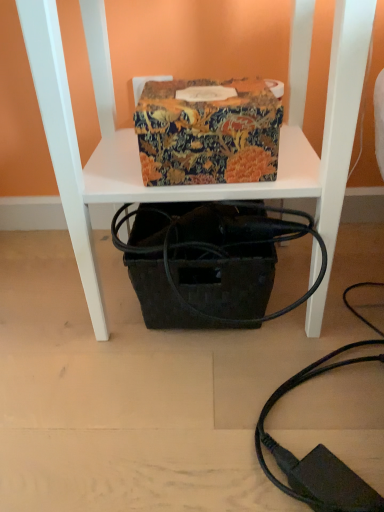
Question: Does patterned fabric box at center appear on the left side of black woven basket at center?

Choices:
 (A) no
 (B) yes

Answer: (B)

Question: Considering the relative sizes of patterned fabric box at center and black woven basket at center in the image provided, is patterned fabric box at center taller than black woven basket at center?

Choices:
 (A) no
 (B) yes

Answer: (A)

Question: Considering the relative sizes of patterned fabric box at center and black woven basket at center in the image provided, is patterned fabric box at center shorter than black woven basket at center?

Choices:
 (A) yes
 (B) no

Answer: (A)

Question: Is patterned fabric box at center further to the viewer compared to black woven basket at center?

Choices:
 (A) no
 (B) yes

Answer: (A)

Question: From the image's perspective, does patterned fabric box at center appear lower than black woven basket at center?

Choices:
 (A) no
 (B) yes

Answer: (A)

Question: Is patterned fabric box at center bigger or smaller than black woven basket at lower center?

Choices:
 (A) big
 (B) small

Answer: (B)

Question: Do you think patterned fabric box at center is within black woven basket at lower center, or outside of it?

Choices:
 (A) inside
 (B) outside

Answer: (A)

Question: Is point (259, 138) closer or farther from the camera than point (319, 175)?

Choices:
 (A) closer
 (B) farther

Answer: (A)

Question: Considering the relative positions of patterned fabric box at center and black woven basket at lower center in the image provided, is patterned fabric box at center to the left or to the right of black woven basket at lower center?

Choices:
 (A) right
 (B) left

Answer: (B)

Question: Would you say black woven basket at lower center is inside or outside black woven basket at center?

Choices:
 (A) inside
 (B) outside

Answer: (B)

Question: From their relative heights in the image, would you say black woven basket at lower center is taller or shorter than black woven basket at center?

Choices:
 (A) tall
 (B) short

Answer: (A)

Question: In the image, is black woven basket at lower center positioned in front of or behind black woven basket at center?

Choices:
 (A) behind
 (B) front

Answer: (B)

Question: Based on their positions, is black woven basket at lower center located to the left or right of black woven basket at center?

Choices:
 (A) right
 (B) left

Answer: (A)

Question: From the image's perspective, is patterned fabric box at center above or below black woven basket at center?

Choices:
 (A) below
 (B) above

Answer: (B)

Question: Is point (231, 129) positioned closer to the camera than point (183, 197)?

Choices:
 (A) farther
 (B) closer

Answer: (B)